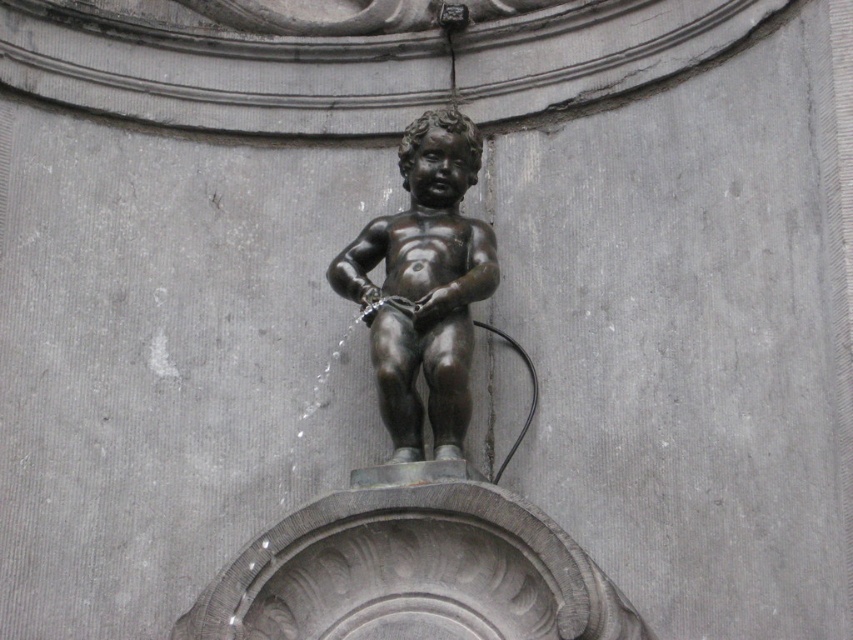
You are standing at the center of a circular plaza and see the bronze statue at center. If you walk straight ahead, will you move toward the statue?

Yes, because the bronze statue at center is located at point (x=416, y=461), which is directly ahead from the center of the plaza.